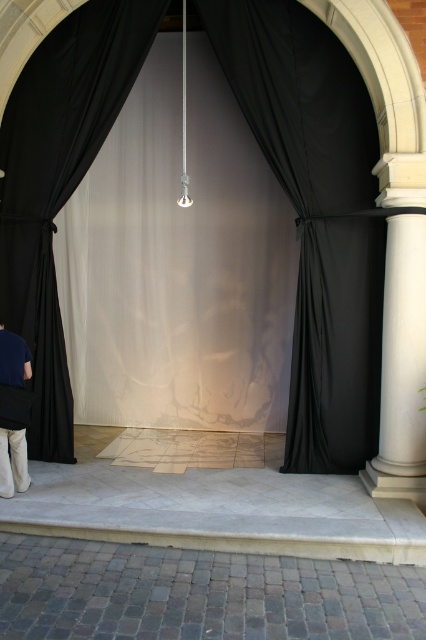
You are standing in front of the arched doorway and want to place a small decoration exactly at the point marked as point (316, 216). Based on the scene description, what object is located at that coordinate?

The point (316, 216) is on the black silk curtain at center.

You are a stagehand preparing for a performance. You need to move a 1.5 meter long equipment cart from the black fabric curtain at center to the white marble stage at center. Is there enough space to maneuver the cart between them?

The black fabric curtain at center is 1.51 meters away from the white marble stage at center. Since the equipment cart is 1.5 meters long, there is just enough space to maneuver it between them as the distance is slightly greater than the cart length.